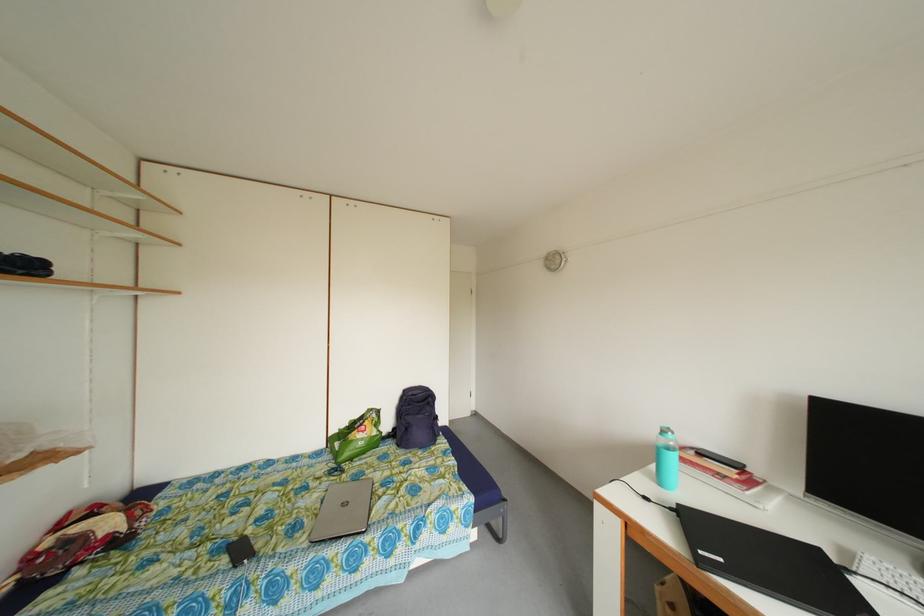
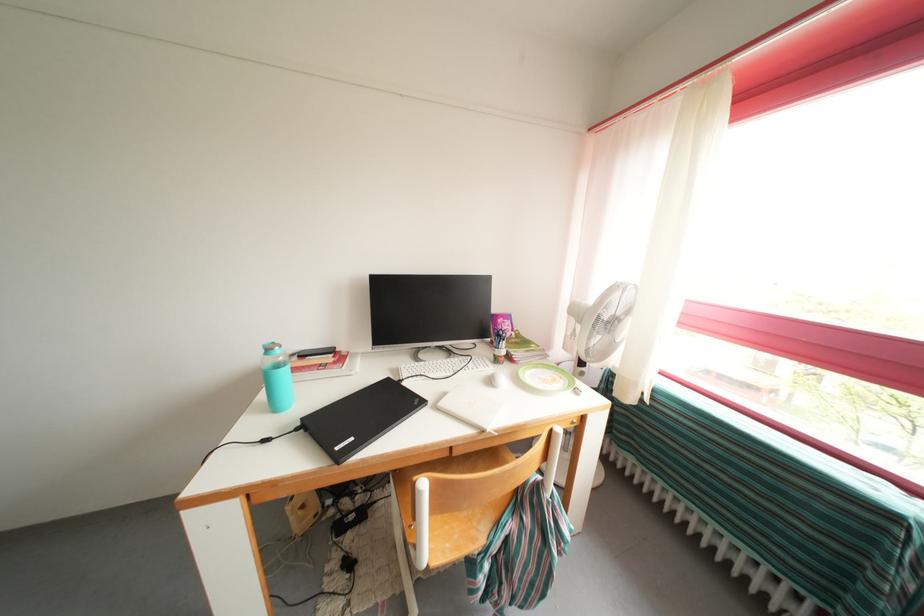
The first image is from the beginning of the video and the second image is from the end. How did the camera likely rotate when shooting the video?

The camera rotated toward right-down.